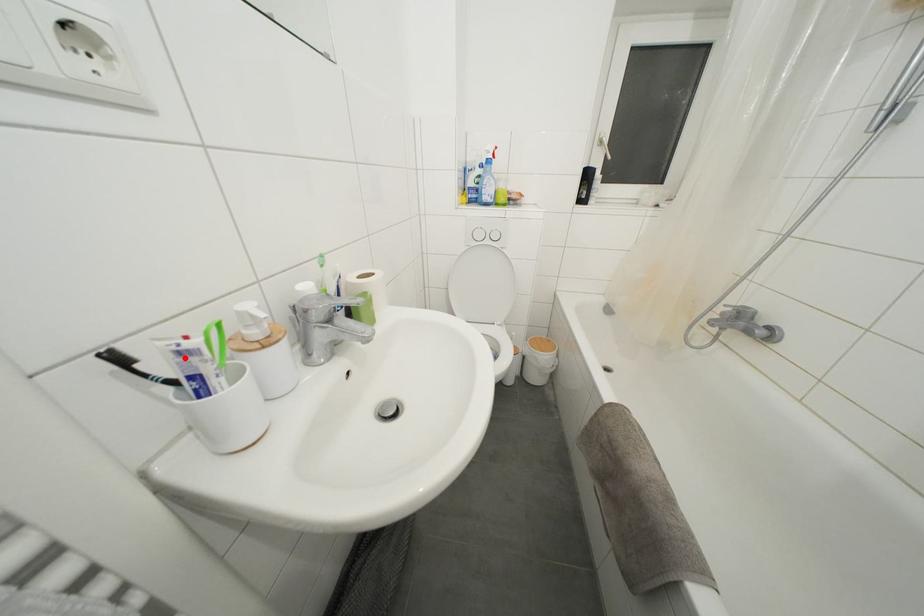
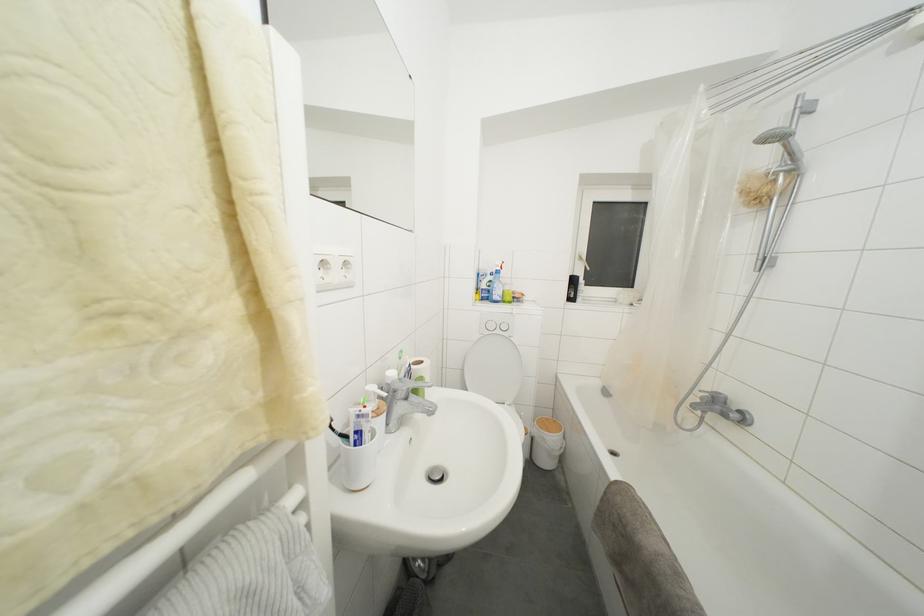
The point at the highlighted location is marked in the first image. Where is the corresponding point in the second image?

(362, 421)